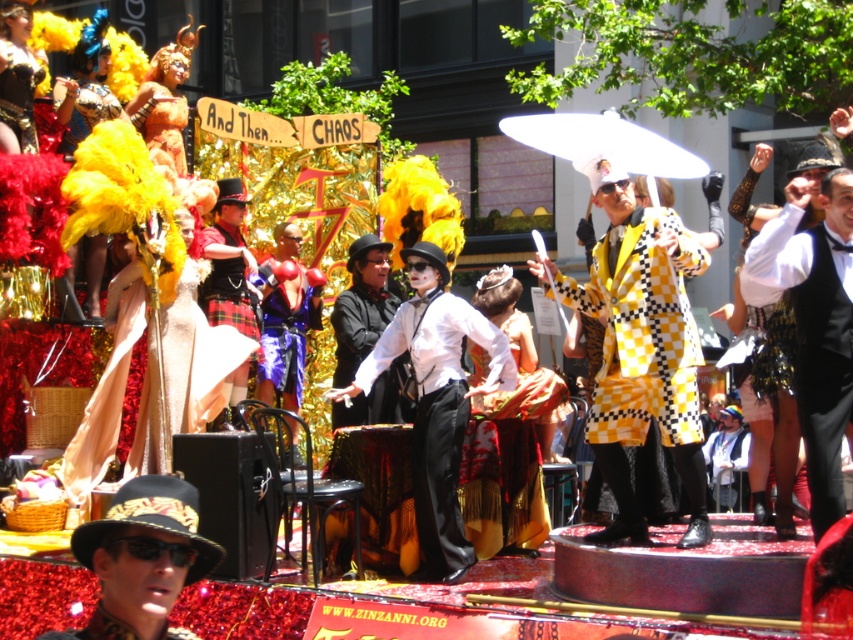
Question: Which point is farther from the camera taking this photo?

Choices:
 (A) [602, 268]
 (B) [288, 317]
 (C) [810, 360]

Answer: (B)

Question: Is black textured hat at center above shiny gold feathers at upper left?

Choices:
 (A) no
 (B) yes

Answer: (A)

Question: Which point appears closest to the camera in this image?

Choices:
 (A) (314, 307)
 (B) (816, 384)
 (C) (374, 316)

Answer: (B)

Question: Which point is farther from the camera taking this photo?

Choices:
 (A) (44, 70)
 (B) (801, 298)

Answer: (A)

Question: Does yellow checkered coat at center have a smaller size compared to white matte suit at center?

Choices:
 (A) no
 (B) yes

Answer: (A)

Question: Is white matte suit at center below shiny gold feathers at upper left?

Choices:
 (A) no
 (B) yes

Answer: (B)